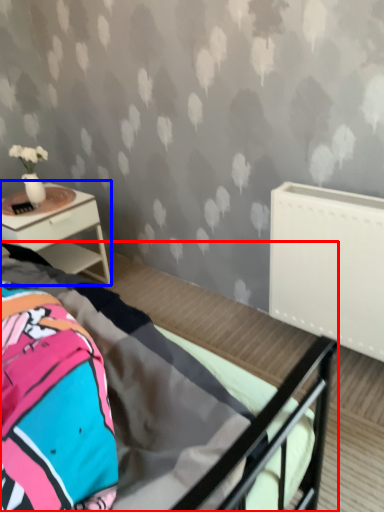
Question: Which object appears closest to the camera in this image, bed (highlighted by a red box) or nightstand (highlighted by a blue box)?

Choices:
 (A) bed
 (B) nightstand

Answer: (A)